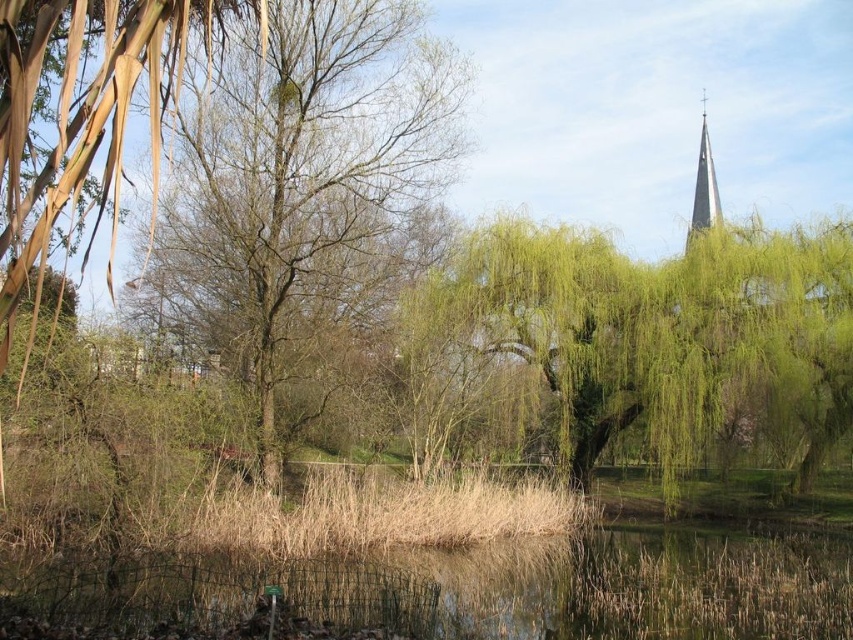
You are standing on the path and see the green grassy water at lower center and the dry grass at center. Which one is closer to your feet?

The green grassy water at lower center is closer to your feet because it is located below the dry grass at center.

You are standing at the edge of the pond and want to place a small decorative rock. The green grassy water at lower center is where you want to avoid placing it. Based on the coordinates provided, where should you place the rock instead?

The green grassy water at lower center is located at point (483, 588). To avoid placing the rock there, choose a location with different coordinates, such as near the weeping willow tree on the right or among the leafless trees in the background.

You are an artist planning to paint the pond scene. You want to emphasize the contrast between the bare branches at center and dry grass at center. Which object should you make larger in your painting to highlight this contrast?

To emphasize the contrast between the bare branches at center and dry grass at center, you should make the bare branches at center larger in your painting since it is already larger compared to the dry grass at center in the scene.